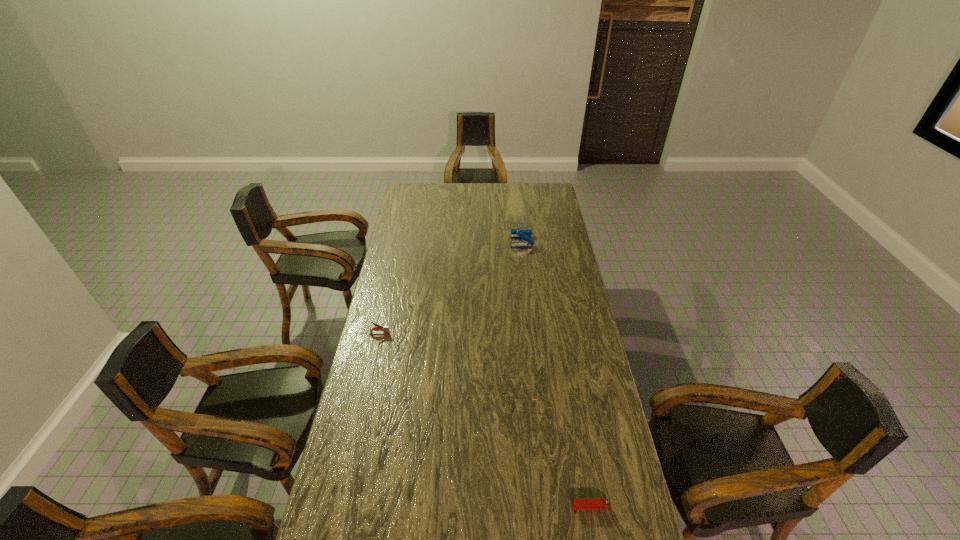
This screenshot has height=540, width=960. I want to click on free space at the right edge of the desktop, so click(x=559, y=358).

Identify the location of blank space at the far right corner of the desktop. The height and width of the screenshot is (540, 960). (552, 201).

You are a GUI agent. You are given a task and a screenshot of the screen. Output one action in this format:
    pyautogui.click(x=<x>, y=<y>)
    Task: Click on the free space between the leftmost object and the second shortest object
    
    Given the screenshot: What is the action you would take?
    pyautogui.click(x=450, y=360)

Image resolution: width=960 pixels, height=540 pixels. I want to click on vacant area that lies between the tallest stapler and the nearest object, so click(556, 374).

In order to click on vacant space that is in between the farthest stapler and the shortest object in this screenshot , I will do `click(556, 374)`.

You are a GUI agent. You are given a task and a screenshot of the screen. Output one action in this format:
    pyautogui.click(x=<x>, y=<y>)
    Task: Click on the vacant space in between the tallest stapler and the third farthest object
    
    Given the screenshot: What is the action you would take?
    pyautogui.click(x=521, y=314)

Identify the location of vacant space that is in between the leftmost stapler and the nearest object. (485, 420).

At what (x,y) coordinates should I click in order to perform the action: click on free point between the farthest stapler and the shortest stapler. Please return your answer as a coordinate pair (x, y). The width and height of the screenshot is (960, 540). Looking at the image, I should click on (556, 374).

Identify the location of vacant space that is in between the nearest stapler and the farthest object. This screenshot has height=540, width=960. (556, 374).

The width and height of the screenshot is (960, 540). I want to click on vacant area that lies between the second tallest stapler and the shortest stapler, so click(x=485, y=420).